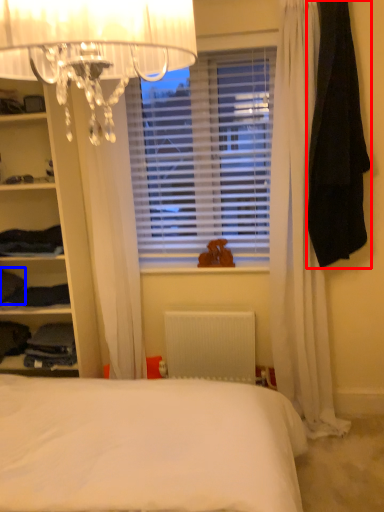
Question: Which point is further to the camera, clothing (highlighted by a red box) or clothing (highlighted by a blue box)?

Choices:
 (A) clothing
 (B) clothing

Answer: (B)